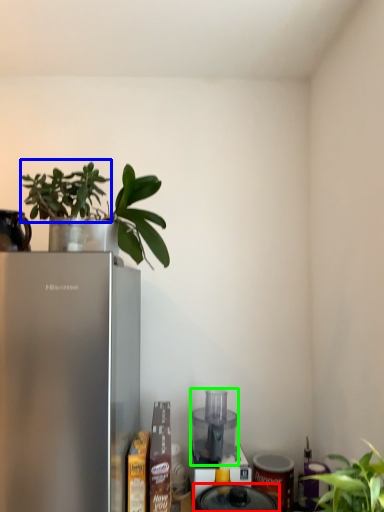
Question: Which is farther away from appliance (highlighted by a red box)? plant (highlighted by a blue box) or appliance (highlighted by a green box)?

Choices:
 (A) plant
 (B) appliance

Answer: (A)